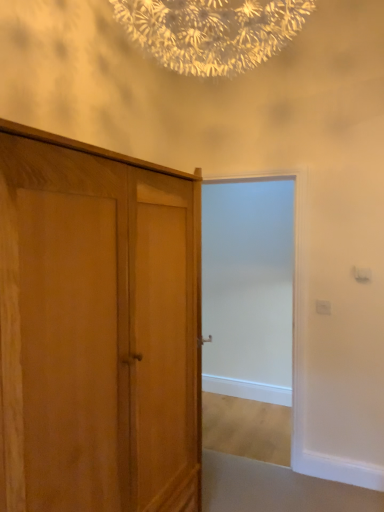
Question: Is white frosted glass door at center taller or shorter than wooden wardrobe at left?

Choices:
 (A) short
 (B) tall

Answer: (B)

Question: From the image's perspective, is white frosted glass door at center positioned above or below wooden wardrobe at left?

Choices:
 (A) below
 (B) above

Answer: (B)

Question: Considering the relative positions of white frosted glass door at center and wooden wardrobe at left in the image provided, is white frosted glass door at center to the left or to the right of wooden wardrobe at left?

Choices:
 (A) left
 (B) right

Answer: (B)

Question: Which is correct: wooden wardrobe at left is inside white frosted glass door at center, or outside of it?

Choices:
 (A) outside
 (B) inside

Answer: (A)

Question: Is wooden wardrobe at left to the left or to the right of white frosted glass door at center in the image?

Choices:
 (A) left
 (B) right

Answer: (A)

Question: From their relative heights in the image, would you say wooden wardrobe at left is taller or shorter than white frosted glass door at center?

Choices:
 (A) tall
 (B) short

Answer: (B)

Question: From a real-world perspective, is wooden wardrobe at left above or below white frosted glass door at center?

Choices:
 (A) below
 (B) above

Answer: (A)